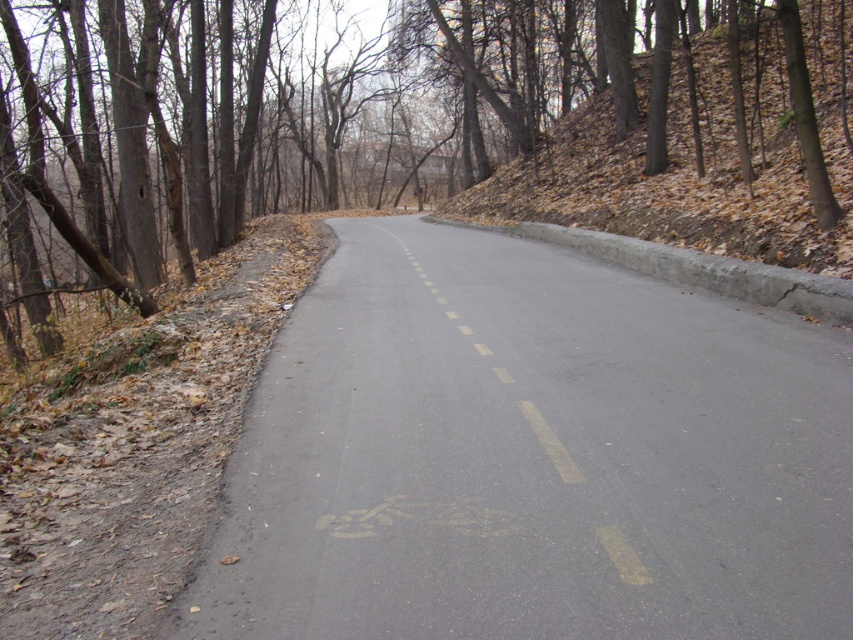
Question: Is asphalt road at center above brown bark tree at center?

Choices:
 (A) yes
 (B) no

Answer: (B)

Question: Which object is closer to the camera taking this photo?

Choices:
 (A) asphalt road at center
 (B) brown bark tree at center

Answer: (A)

Question: Considering the relative positions of asphalt road at center and brown bark tree at center in the image provided, where is asphalt road at center located with respect to brown bark tree at center?

Choices:
 (A) right
 (B) left

Answer: (A)

Question: Can you confirm if asphalt road at center is positioned above brown bark tree at center?

Choices:
 (A) yes
 (B) no

Answer: (B)